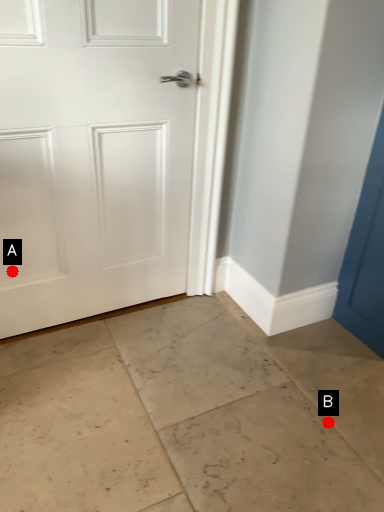
Question: Two points are circled on the image, labeled by A and B beside each circle. Which point is further to the camera?

Choices:
 (A) A is further
 (B) B is further

Answer: (A)